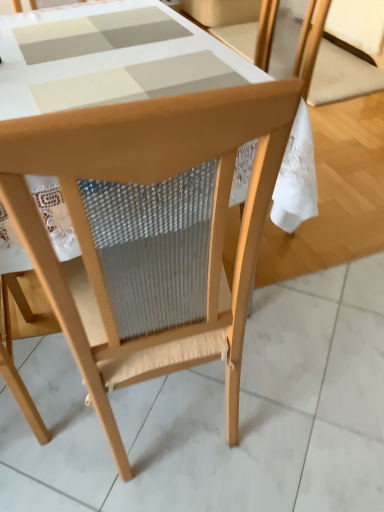
Find the location of a particular element. vacant space underneath natural wood chair at center, marked as the 2th chair in a top-to-bottom arrangement (from a real-world perspective) is located at coordinates (172, 416).